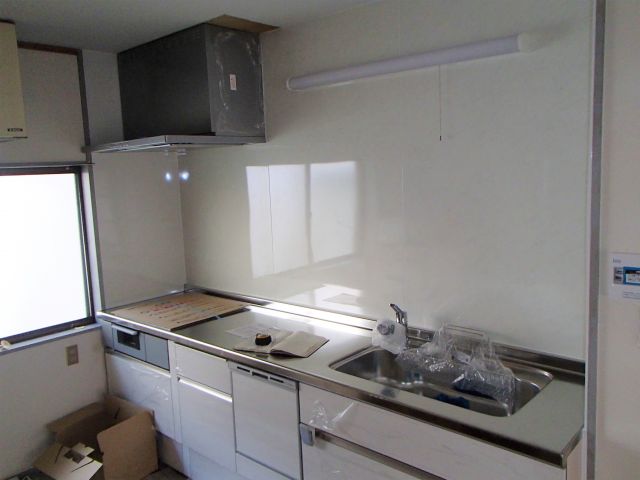
The image size is (640, 480). Find the location of `drawers`. drawers is located at coordinates (384, 421), (353, 461).